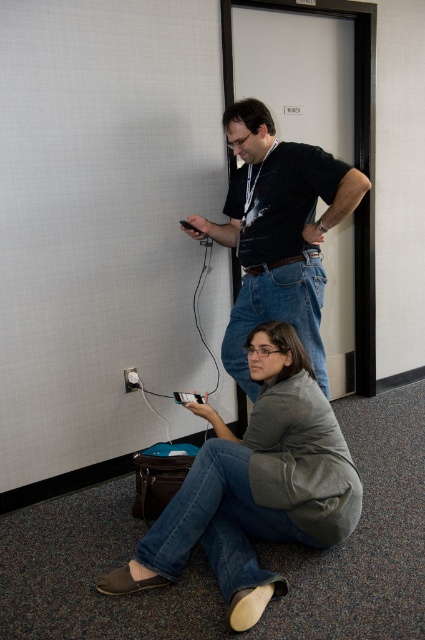
Which is more to the left, black matte shirt at center or white plastic plug at lower left?

From the viewer's perspective, white plastic plug at lower left appears more on the left side.

In the scene shown: Does black matte shirt at center appear on the left side of white plastic plug at lower left?

Incorrect, black matte shirt at center is not on the left side of white plastic plug at lower left.

Which is in front, point (265, 256) or point (129, 384)?

Point (265, 256) is in front.

This screenshot has height=640, width=425. I want to click on black matte shirt at center, so click(277, 232).

Between gray cotton shirt at lower center and white plastic plug at lower left, which one has less height?

Standing shorter between the two is white plastic plug at lower left.

Which is behind, point (212, 467) or point (133, 376)?

Point (133, 376)

Who is more distant from viewer, (x=283, y=428) or (x=135, y=380)?

Point (x=135, y=380)

Where is `gray cotton shirt at lower center`? This screenshot has height=640, width=425. gray cotton shirt at lower center is located at coordinates (255, 484).

Can you confirm if gray cotton shirt at lower center is bigger than black matte shirt at center?

Yes.

Is gray cotton shirt at lower center thinner than black matte shirt at center?

No.

Does point (181, 524) lie behind point (322, 365)?

No.

The width and height of the screenshot is (425, 640). I want to click on gray cotton shirt at lower center, so click(x=255, y=484).